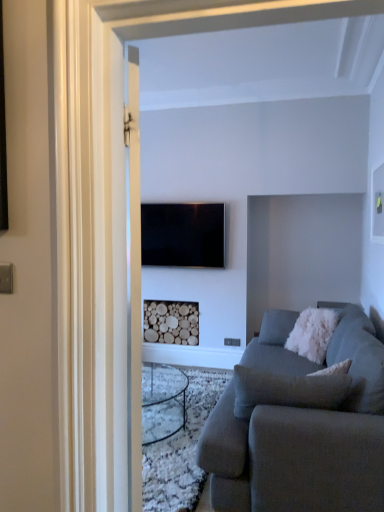
Question: From a real-world perspective, is flat screen tv at center positioned over wooden logs at center based on gravity?

Choices:
 (A) no
 (B) yes

Answer: (B)

Question: Does flat screen tv at center have a larger size compared to wooden logs at center?

Choices:
 (A) yes
 (B) no

Answer: (B)

Question: Considering the relative sizes of flat screen tv at center and wooden logs at center in the image provided, is flat screen tv at center shorter than wooden logs at center?

Choices:
 (A) yes
 (B) no

Answer: (B)

Question: Is flat screen tv at center beside wooden logs at center?

Choices:
 (A) yes
 (B) no

Answer: (B)

Question: Is the depth of flat screen tv at center less than that of wooden logs at center?

Choices:
 (A) no
 (B) yes

Answer: (B)

Question: Is flat screen tv at center in front of or behind wooden logs at center in the image?

Choices:
 (A) front
 (B) behind

Answer: (A)

Question: Is flat screen tv at center spatially inside wooden logs at center, or outside of it?

Choices:
 (A) inside
 (B) outside

Answer: (B)

Question: Based on their positions, is flat screen tv at center located to the left or right of wooden logs at center?

Choices:
 (A) right
 (B) left

Answer: (A)

Question: Considering the positions of flat screen tv at center and wooden logs at center in the image, is flat screen tv at center taller or shorter than wooden logs at center?

Choices:
 (A) tall
 (B) short

Answer: (A)

Question: Considering the positions of wooden logs at center and white fluffy pillow at right in the image, is wooden logs at center wider or thinner than white fluffy pillow at right?

Choices:
 (A) thin
 (B) wide

Answer: (A)

Question: Looking at the image, does wooden logs at center seem bigger or smaller compared to white fluffy pillow at right?

Choices:
 (A) small
 (B) big

Answer: (A)

Question: From the image's perspective, is wooden logs at center located above or below white fluffy pillow at right?

Choices:
 (A) below
 (B) above

Answer: (A)

Question: Would you say wooden logs at center is inside or outside white fluffy pillow at right?

Choices:
 (A) inside
 (B) outside

Answer: (B)

Question: From the image's perspective, is white fluffy pillow at right located above or below wooden logs at center?

Choices:
 (A) below
 (B) above

Answer: (B)

Question: Would you say white fluffy pillow at right is to the left or to the right of wooden logs at center in the picture?

Choices:
 (A) right
 (B) left

Answer: (A)